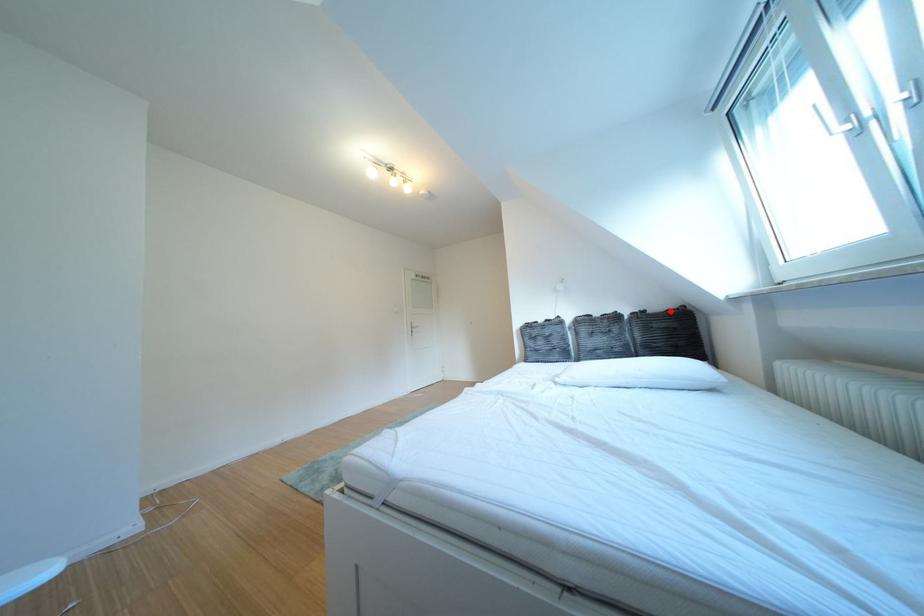
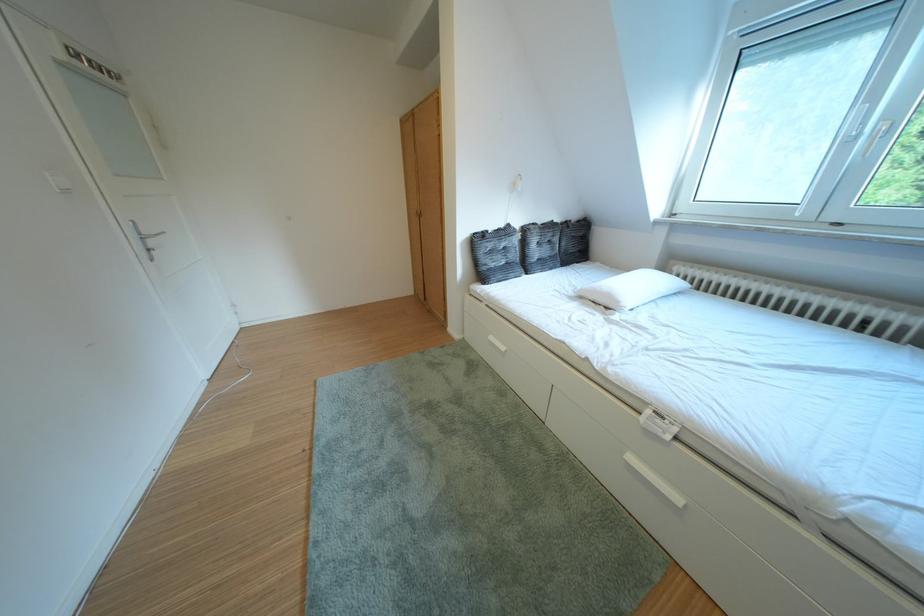
Question: A red point is marked in image1. In image2, is the corresponding 3D point closer to the camera or farther? Reply with the corresponding letter.

Choices:
 (A) The corresponding 3D point is closer.
 (B) The corresponding 3D point is farther.

Answer: (A)